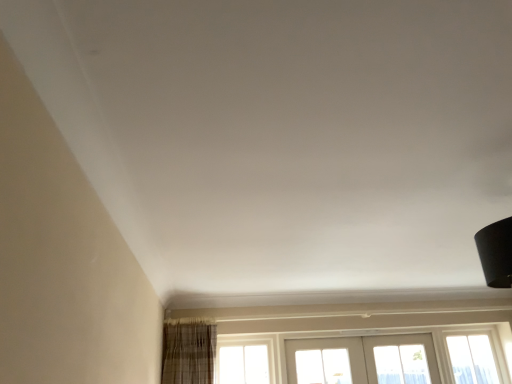
Identify the location of clear glass window at lower right, the 2th window from the left. click(472, 359).

The height and width of the screenshot is (384, 512). What do you see at coordinates (472, 359) in the screenshot?
I see `clear glass window at lower right, placed as the 1th window when sorted from right to left` at bounding box center [472, 359].

Locate an element on the screen. The image size is (512, 384). clear glass window at center, marked as the second window in a right-to-left arrangement is located at coordinates (244, 363).

Find the location of a particular element. white painted wood screen door at lower center is located at coordinates (362, 360).

From the image's perspective, which object appears higher, clear glass window at center, placed as the 1th window when sorted from left to right, or white painted wood screen door at lower center?

clear glass window at center, placed as the 1th window when sorted from left to right, is shown above in the image.

Between clear glass window at center, placed as the 1th window when sorted from left to right, and white painted wood screen door at lower center, which one has smaller size?

Smaller between the two is clear glass window at center, placed as the 1th window when sorted from left to right.

From the picture: Is clear glass window at center, placed as the 1th window when sorted from left to right, far from white painted wood screen door at lower center?

Actually, clear glass window at center, placed as the 1th window when sorted from left to right, and white painted wood screen door at lower center are a little close together.

Considering the relative sizes of clear glass window at center, marked as the second window in a right-to-left arrangement, and white painted wood screen door at lower center in the image provided, is clear glass window at center, marked as the second window in a right-to-left arrangement, thinner than white painted wood screen door at lower center?

No, clear glass window at center, marked as the second window in a right-to-left arrangement, is not thinner than white painted wood screen door at lower center.

Is clear glass window at lower right, the 2th window from the left, at the right side of white painted wood screen door at lower center?

Yes, clear glass window at lower right, the 2th window from the left, is to the right of white painted wood screen door at lower center.

Is white painted wood screen door at lower center inside clear glass window at lower right, placed as the 1th window when sorted from right to left?

Actually, white painted wood screen door at lower center is outside clear glass window at lower right, placed as the 1th window when sorted from right to left.

Is clear glass window at center, marked as the second window in a right-to-left arrangement, located within white painted wood screen door at lower center?

No, clear glass window at center, marked as the second window in a right-to-left arrangement, is not surrounded by white painted wood screen door at lower center.

Can you confirm if white painted wood screen door at lower center is shorter than clear glass window at center, marked as the second window in a right-to-left arrangement?

In fact, white painted wood screen door at lower center may be taller than clear glass window at center, marked as the second window in a right-to-left arrangement.

Is white painted wood screen door at lower center thinner than clear glass window at center, placed as the 1th window when sorted from left to right?

Yes, white painted wood screen door at lower center is thinner than clear glass window at center, placed as the 1th window when sorted from left to right.

Considering the relative sizes of white painted wood screen door at lower center and clear glass window at center, marked as the second window in a right-to-left arrangement, in the image provided, is white painted wood screen door at lower center bigger than clear glass window at center, marked as the second window in a right-to-left arrangement,?

Yes.

Find the location of a particular element. This screenshot has width=512, height=384. screen door above the clear glass window at lower right, the 2th window from the left (from a real-world perspective) is located at coordinates (362, 360).

Can you confirm if white painted wood screen door at lower center is positioned to the right of clear glass window at lower right, the 2th window from the left?

No, white painted wood screen door at lower center is not to the right of clear glass window at lower right, the 2th window from the left.

Is clear glass window at lower right, the 2th window from the left, completely or partially inside white painted wood screen door at lower center?

No, clear glass window at lower right, the 2th window from the left, is not inside white painted wood screen door at lower center.

Based on the photo, is clear glass window at lower right, the 2th window from the left, next to clear glass window at center, placed as the 1th window when sorted from left to right, and touching it?

No, clear glass window at lower right, the 2th window from the left, is not next to clear glass window at center, placed as the 1th window when sorted from left to right.

Considering the sizes of objects clear glass window at lower right, the 2th window from the left, and clear glass window at center, placed as the 1th window when sorted from left to right, in the image provided, who is bigger, clear glass window at lower right, the 2th window from the left, or clear glass window at center, placed as the 1th window when sorted from left to right,?

With larger size is clear glass window at lower right, the 2th window from the left.

How different are the orientations of clear glass window at lower right, placed as the 1th window when sorted from right to left, and clear glass window at center, marked as the second window in a right-to-left arrangement, in degrees?

clear glass window at lower right, placed as the 1th window when sorted from right to left, and clear glass window at center, marked as the second window in a right-to-left arrangement, are facing 0.000859 degrees away from each other.

Could you tell me if clear glass window at lower right, the 2th window from the left, is turned towards clear glass window at center, placed as the 1th window when sorted from left to right?

No, clear glass window at lower right, the 2th window from the left, is not facing towards clear glass window at center, placed as the 1th window when sorted from left to right.

Considering the sizes of objects clear glass window at center, marked as the second window in a right-to-left arrangement, and clear glass window at lower right, the 2th window from the left, in the image provided, who is shorter, clear glass window at center, marked as the second window in a right-to-left arrangement, or clear glass window at lower right, the 2th window from the left,?

clear glass window at center, marked as the second window in a right-to-left arrangement, is shorter.

Which object is more forward, clear glass window at center, placed as the 1th window when sorted from left to right, or clear glass window at lower right, placed as the 1th window when sorted from right to left?

Positioned in front is clear glass window at center, placed as the 1th window when sorted from left to right.

Which is less distant, [224,382] or [474,350]?

Point [224,382] is positioned closer to the camera compared to point [474,350].

Between clear glass window at center, marked as the second window in a right-to-left arrangement, and clear glass window at lower right, the 2th window from the left, which one appears on the right side from the viewer's perspective?

clear glass window at lower right, the 2th window from the left, is more to the right.

Where is `window above the white painted wood screen door at lower center (from the image's perspective)`? This screenshot has width=512, height=384. window above the white painted wood screen door at lower center (from the image's perspective) is located at coordinates (244, 363).

You are a GUI agent. You are given a task and a screenshot of the screen. Output one action in this format:
    pyautogui.click(x=<x>, y=<y>)
    Task: Click on the window located on the right of white painted wood screen door at lower center
    This screenshot has width=512, height=384.
    Given the screenshot: What is the action you would take?
    pyautogui.click(x=472, y=359)

Estimate the real-world distances between objects in this image. Which object is closer to clear glass window at center, placed as the 1th window when sorted from left to right, white painted wood screen door at lower center or clear glass window at lower right, the 2th window from the left?

Based on the image, white painted wood screen door at lower center appears to be nearer to clear glass window at center, placed as the 1th window when sorted from left to right.

Estimate the real-world distances between objects in this image. Which object is closer to white painted wood screen door at lower center, clear glass window at lower right, placed as the 1th window when sorted from right to left, or clear glass window at center, marked as the second window in a right-to-left arrangement?

Based on the image, clear glass window at lower right, placed as the 1th window when sorted from right to left, appears to be nearer to white painted wood screen door at lower center.

Which object lies further to the anchor point clear glass window at lower right, the 2th window from the left, white painted wood screen door at lower center or clear glass window at center, placed as the 1th window when sorted from left to right?

Based on the image, clear glass window at center, placed as the 1th window when sorted from left to right, appears to be further to clear glass window at lower right, the 2th window from the left.

When comparing their distances from white painted wood screen door at lower center, does clear glass window at center, marked as the second window in a right-to-left arrangement, or clear glass window at lower right, the 2th window from the left, seem closer?

The object closer to white painted wood screen door at lower center is clear glass window at lower right, the 2th window from the left.

Estimate the real-world distances between objects in this image. Which object is further from clear glass window at center, marked as the second window in a right-to-left arrangement, clear glass window at lower right, placed as the 1th window when sorted from right to left, or white painted wood screen door at lower center?

clear glass window at lower right, placed as the 1th window when sorted from right to left, is positioned further to the anchor clear glass window at center, marked as the second window in a right-to-left arrangement.

Based on the photo, estimate the real-world distances between objects in this image. Which object is further from clear glass window at lower right, the 2th window from the left, clear glass window at center, placed as the 1th window when sorted from left to right, or white painted wood screen door at lower center?

clear glass window at center, placed as the 1th window when sorted from left to right, is positioned further to the anchor clear glass window at lower right, the 2th window from the left.

Where is `screen door between clear glass window at center, placed as the 1th window when sorted from left to right, and clear glass window at lower right, the 2th window from the left`? This screenshot has width=512, height=384. screen door between clear glass window at center, placed as the 1th window when sorted from left to right, and clear glass window at lower right, the 2th window from the left is located at coordinates (362, 360).